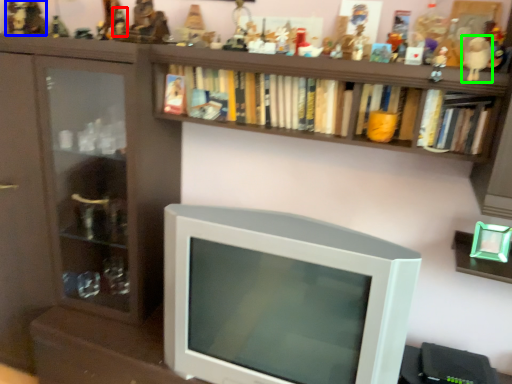
Question: Which object is positioned farthest from toy (highlighted by a red box)? Select from toy (highlighted by a blue box) and toy (highlighted by a green box).

Choices:
 (A) toy
 (B) toy

Answer: (B)